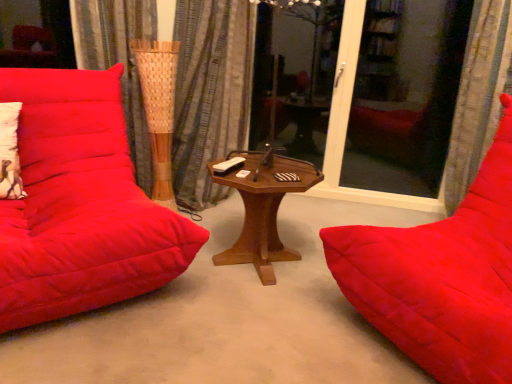
Question: Is velvet red studio couch at left, which is counted as the second studio couch, starting from the right, in front of or behind textured fabric curtain at right, placed as the 2th curtain when sorted from left to right, in the image?

Choices:
 (A) behind
 (B) front

Answer: (B)

Question: Based on their positions, is velvet red studio couch at left, the first studio couch in the left-to-right sequence, located to the left or right of textured fabric curtain at right, the 1th curtain in the right-to-left sequence?

Choices:
 (A) right
 (B) left

Answer: (B)

Question: Which of these objects is positioned closest to the velvet red studio couch at right, the second studio couch positioned from the left?

Choices:
 (A) textured fabric curtain at right, placed as the 2th curtain when sorted from left to right
 (B) transparent glass screen door at right
 (C) blue striped curtain at center, which is the second curtain in right-to-left order
 (D) wooden hexagonal table at center
 (E) velvet red studio couch at left, the first studio couch in the left-to-right sequence

Answer: (D)

Question: Which object is the farthest from the wooden hexagonal table at center?

Choices:
 (A) textured fabric curtain at right, the 1th curtain in the right-to-left sequence
 (B) transparent glass screen door at right
 (C) velvet red studio couch at left, which is counted as the second studio couch, starting from the right
 (D) velvet red studio couch at right, the second studio couch positioned from the left
 (E) blue striped curtain at center, which is the second curtain in right-to-left order

Answer: (B)